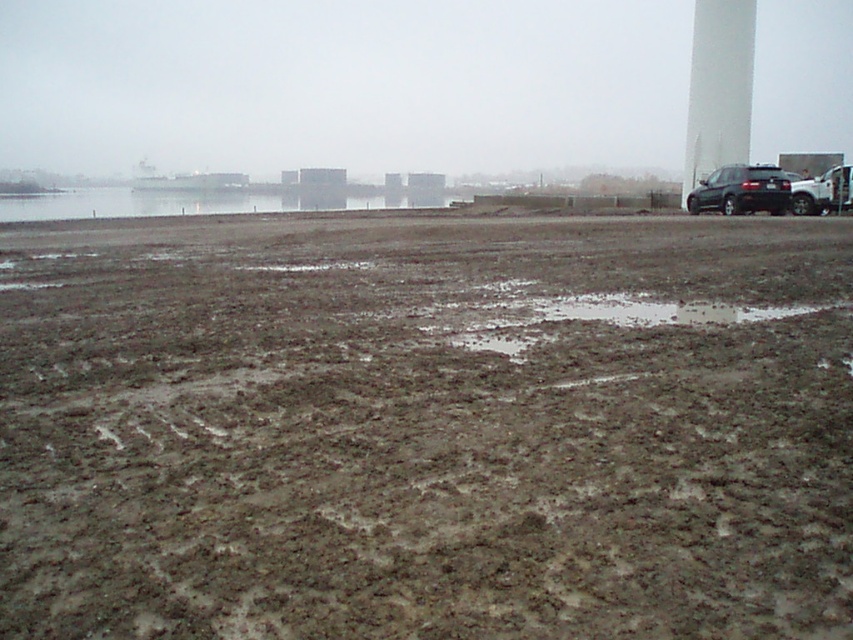
You are a surveyor trying to locate the white smooth water tower at upper right in the image. According to the coordinates provided, where exactly is it positioned?

The white smooth water tower at upper right is located at point coordinates (718, 88).

You are a delivery drone that needs to land on the dull brown dirt at center. However, there is a white smooth water tower at upper right in your flight path. Based on the scene, can you safely descend vertically without hitting the water tower?

The dull brown dirt at center is closer to the viewer than the white smooth water tower at upper right, so the drone can safely descend vertically as the water tower is farther away and won

You are a delivery driver who needs to park your truck near the dull brown dirt at center and the white smooth water tower at upper right. Which of these two objects is closer to your current position if you are standing at the muddy field with tire tracks?

The dull brown dirt at center is closer to your current position because it is smaller than the white smooth water tower at upper right, indicating it is nearer in the scene.